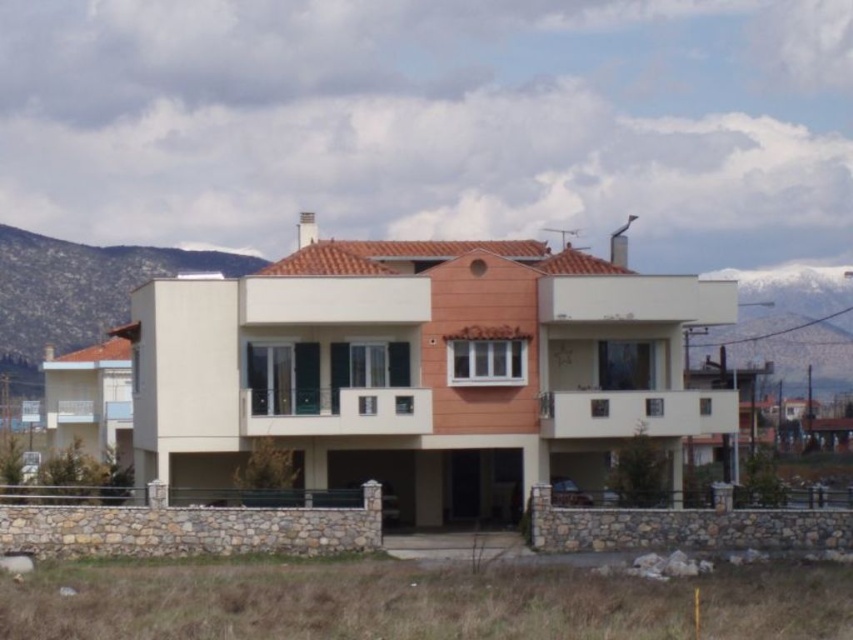
Based on the photo, which is more to the right, brown stone mountain at upper left or snowy white mountain at upper right?

snowy white mountain at upper right

Is brown stone mountain at upper left to the left of snowy white mountain at upper right from the viewer's perspective?

Correct, you'll find brown stone mountain at upper left to the left of snowy white mountain at upper right.

This screenshot has width=853, height=640. I want to click on brown stone mountain at upper left, so click(x=78, y=292).

This screenshot has width=853, height=640. In order to click on brown stone mountain at upper left in this screenshot , I will do `click(78, 292)`.